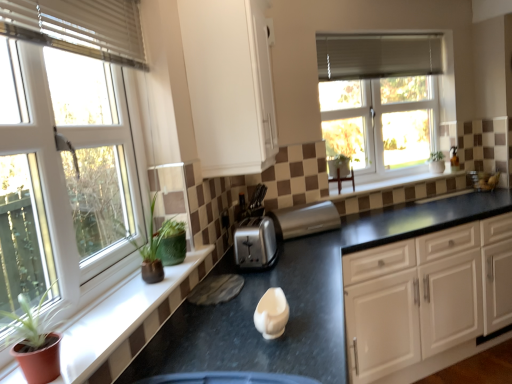
Find the location of a particular element. This screenshot has height=384, width=512. free space in front of satin silver toaster at center, arranged as the first appliance when viewed from the right is located at coordinates (329, 246).